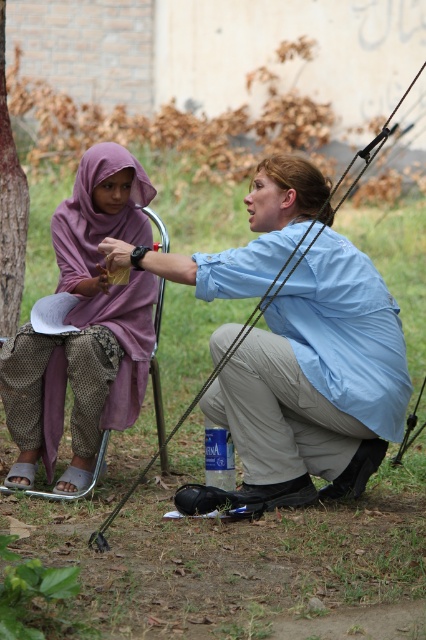
You are a photographer trying to capture both the blue cotton shirt at center and the brown rough bark at left in a single frame. Based on their sizes, which object should you focus on to ensure both are clearly visible in the photo?

The blue cotton shirt at center is larger in size than brown rough bark at left, so focusing on the blue cotton shirt at center would help ensure both are clearly visible since it takes up more space in the frame.